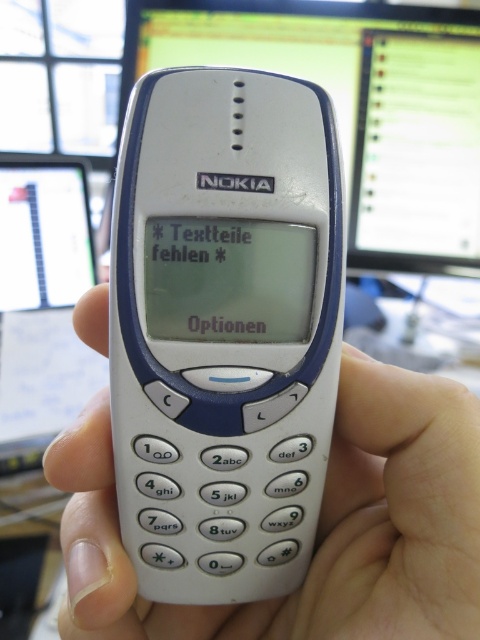
Does white plastic nokia phone at center come behind matte plastic computer screen at upper center?

No.

Can you confirm if white plastic nokia phone at center is positioned below matte plastic computer screen at upper center?

Correct, white plastic nokia phone at center is located below matte plastic computer screen at upper center.

Find the location of a particular element. Image resolution: width=480 pixels, height=640 pixels. white plastic nokia phone at center is located at coordinates (224, 330).

At what (x,y) coordinates should I click in order to perform the action: click on white plastic nokia phone at center. Please return your answer as a coordinate pair (x, y). This screenshot has height=640, width=480. Looking at the image, I should click on (224, 330).

Is point (254, 397) farther from viewer compared to point (92, 486)?

That is False.

This screenshot has width=480, height=640. Describe the element at coordinates (224, 330) in the screenshot. I see `white plastic nokia phone at center` at that location.

The image size is (480, 640). I want to click on white plastic nokia phone at center, so (x=224, y=330).

Does white plastic phone at center come behind matte plastic computer screen at upper center?

No, white plastic phone at center is closer to the viewer.

Is point (87, 420) positioned after point (314, 22)?

No.

Is point (471, 604) less distant than point (141, 74)?

Yes, point (471, 604) is in front of point (141, 74).

Locate an element on the screen. white plastic phone at center is located at coordinates (317, 525).